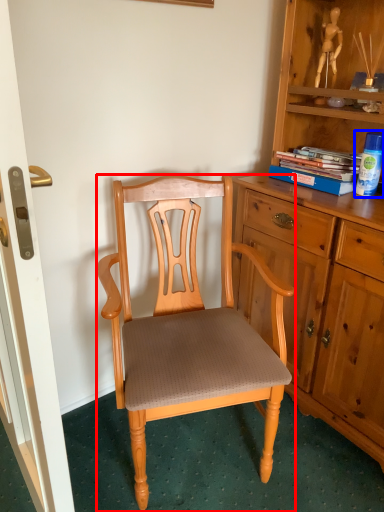
Question: Among these objects, which one is farthest to the camera, chair (highlighted by a red box) or toy (highlighted by a blue box)?

Choices:
 (A) chair
 (B) toy

Answer: (B)